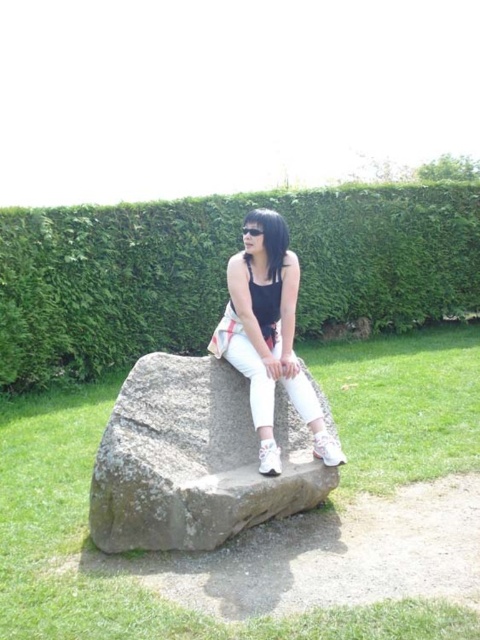
Question: Which object is closer to the camera taking this photo?

Choices:
 (A) matte black tank top at center
 (B) green leafy hedge at upper center
 (C) gray rough stone at center

Answer: (C)

Question: Can you confirm if matte black tank top at center is positioned above transparent plastic goggles at center?

Choices:
 (A) no
 (B) yes

Answer: (A)

Question: Among these objects, which one is farthest from the camera?

Choices:
 (A) green leafy hedge at upper center
 (B) matte black tank top at center
 (C) gray rough stone at center
 (D) transparent plastic goggles at center

Answer: (A)

Question: Based on their relative distances, which object is nearer to the matte black tank top at center?

Choices:
 (A) green leafy hedge at upper center
 (B) transparent plastic goggles at center
 (C) gray rough stone at center

Answer: (C)

Question: Does gray rough stone at center appear on the right side of matte black tank top at center?

Choices:
 (A) yes
 (B) no

Answer: (B)

Question: In this image, where is matte black tank top at center located relative to transparent plastic goggles at center?

Choices:
 (A) below
 (B) above

Answer: (A)